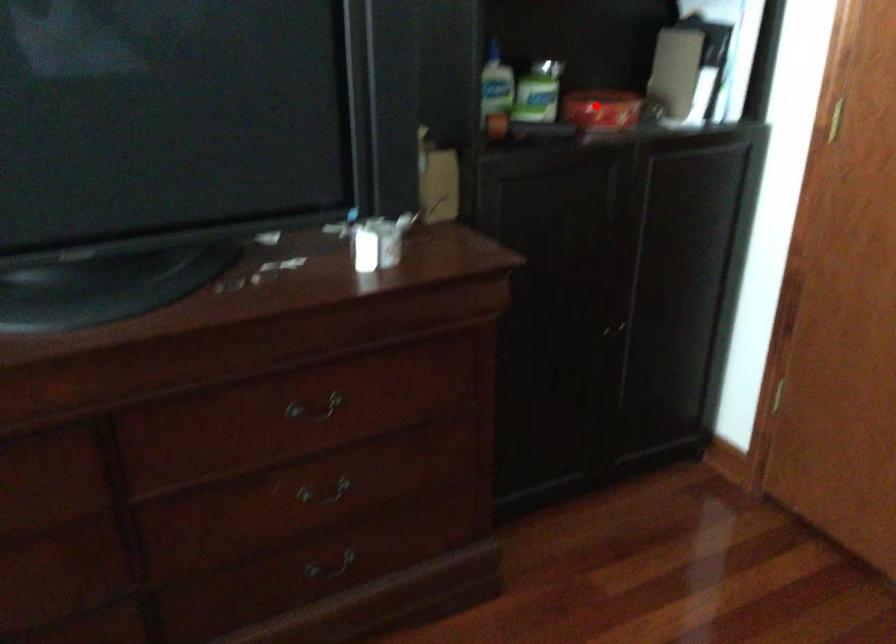
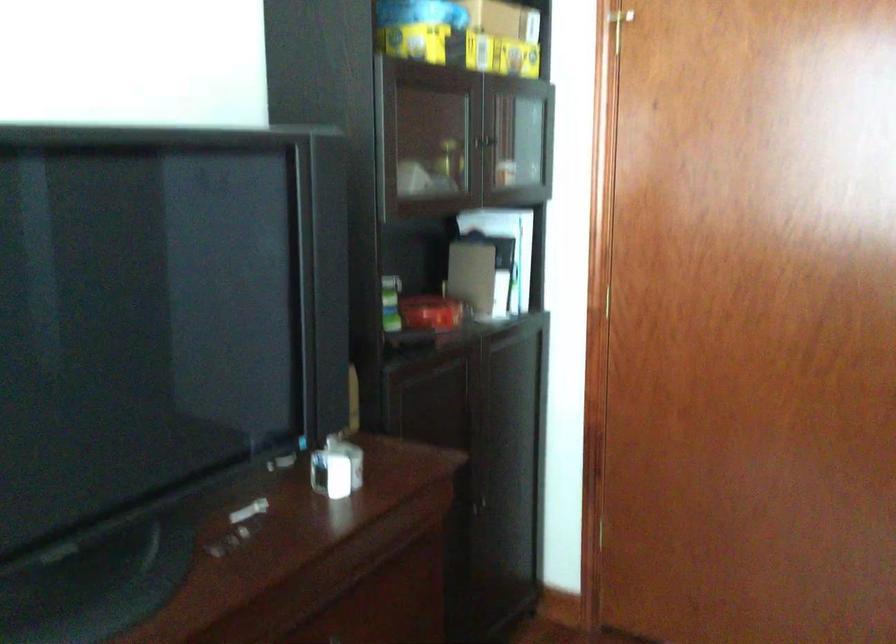
Find the pixel in the second image that matches the highlighted location in the first image.

(431, 313)